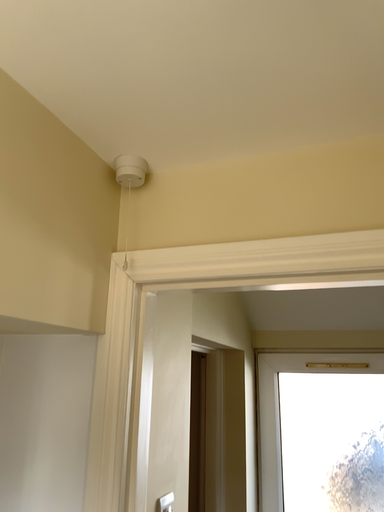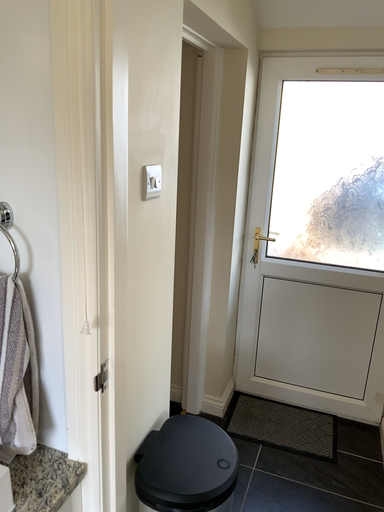
Question: How did the camera likely rotate when shooting the video?

Choices:
 (A) rotated upward
 (B) rotated downward

Answer: (B)